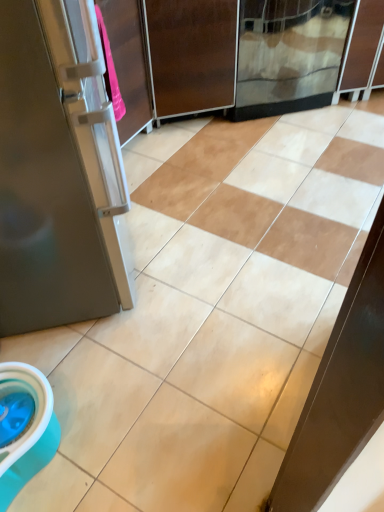
Question: Does brown matte screen door at center, placed as the 1th screen door when sorted from left to right, turn towards transparent glass screen door at upper center, the 2th screen door from the left?

Choices:
 (A) yes
 (B) no

Answer: (B)

Question: From a real-world perspective, is brown matte screen door at center, arranged as the 2th screen door when viewed from the right, under transparent glass screen door at upper center, the 2th screen door from the left?

Choices:
 (A) yes
 (B) no

Answer: (B)

Question: Considering the relative sizes of brown matte screen door at center, placed as the 1th screen door when sorted from left to right, and transparent glass screen door at upper center, the 1th screen door positioned from the right, in the image provided, is brown matte screen door at center, placed as the 1th screen door when sorted from left to right, smaller than transparent glass screen door at upper center, the 1th screen door positioned from the right,?

Choices:
 (A) yes
 (B) no

Answer: (A)

Question: Is transparent glass screen door at upper center, the 1th screen door positioned from the right, completely or partially inside brown matte screen door at center, placed as the 1th screen door when sorted from left to right?

Choices:
 (A) no
 (B) yes

Answer: (A)

Question: Is brown matte screen door at center, arranged as the 2th screen door when viewed from the right, wider than transparent glass screen door at upper center, the 2th screen door from the left?

Choices:
 (A) no
 (B) yes

Answer: (B)

Question: Is brown matte screen door at center, arranged as the 2th screen door when viewed from the right, not near transparent glass screen door at upper center, the 1th screen door positioned from the right?

Choices:
 (A) yes
 (B) no

Answer: (B)

Question: Is transparent glass screen door at upper center, the 2th screen door from the left, not within brown matte screen door at center, arranged as the 2th screen door when viewed from the right?

Choices:
 (A) no
 (B) yes

Answer: (B)

Question: Is transparent glass screen door at upper center, the 1th screen door positioned from the right, shorter than brown matte screen door at center, arranged as the 2th screen door when viewed from the right?

Choices:
 (A) yes
 (B) no

Answer: (A)

Question: From the image's perspective, is transparent glass screen door at upper center, the 2th screen door from the left, below brown matte screen door at center, placed as the 1th screen door when sorted from left to right?

Choices:
 (A) no
 (B) yes

Answer: (A)

Question: Is brown matte screen door at center, placed as the 1th screen door when sorted from left to right, surrounded by transparent glass screen door at upper center, the 1th screen door positioned from the right?

Choices:
 (A) yes
 (B) no

Answer: (B)

Question: From a real-world perspective, is transparent glass screen door at upper center, the 2th screen door from the left, positioned under brown matte screen door at center, placed as the 1th screen door when sorted from left to right, based on gravity?

Choices:
 (A) no
 (B) yes

Answer: (B)

Question: Would you say transparent glass screen door at upper center, the 2th screen door from the left, is a long distance from brown matte screen door at center, placed as the 1th screen door when sorted from left to right?

Choices:
 (A) yes
 (B) no

Answer: (B)

Question: Is brown matte screen door at center, placed as the 1th screen door when sorted from left to right, inside the boundaries of transparent glass screen door at upper center, the 2th screen door from the left, or outside?

Choices:
 (A) inside
 (B) outside

Answer: (B)